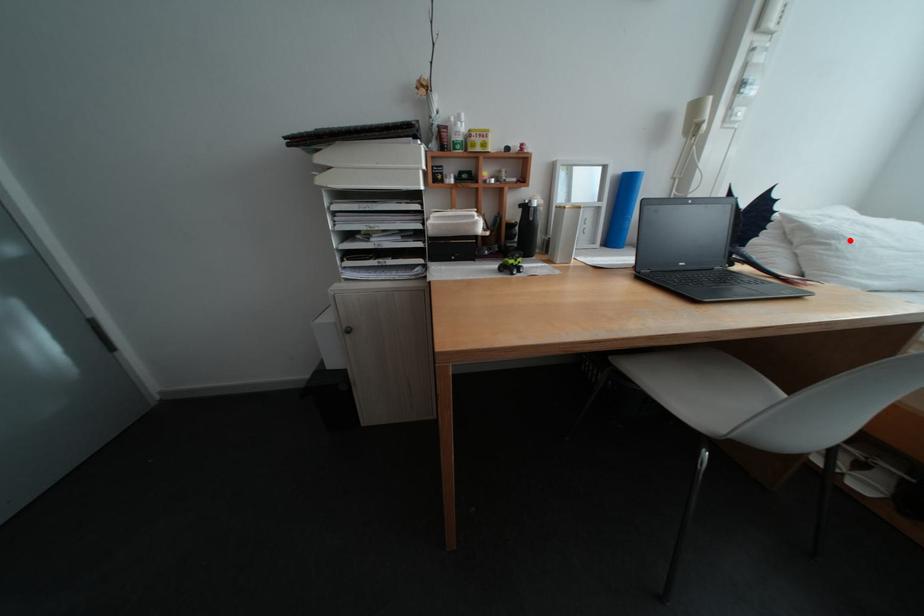
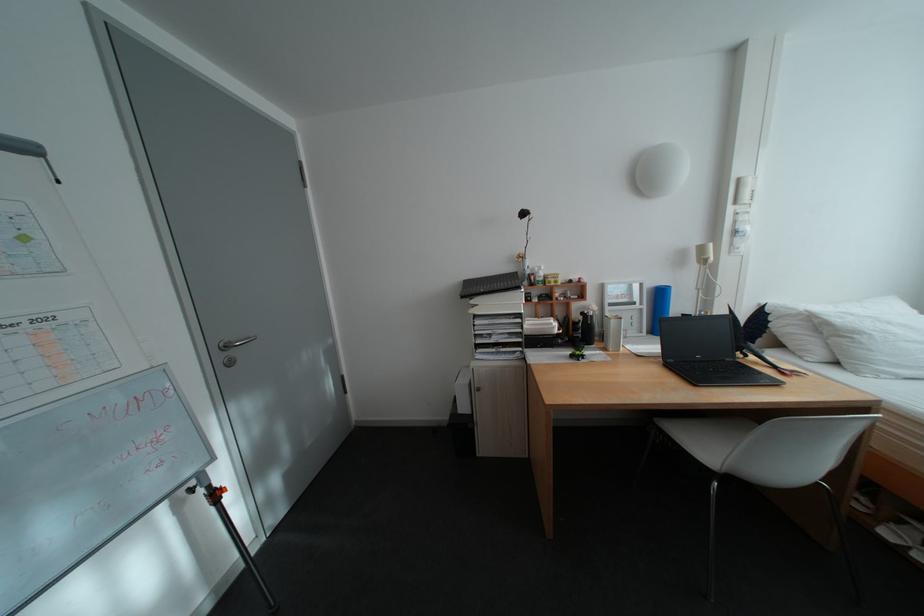
Find the pixel in the second image that matches the highlighted location in the first image.

(871, 334)